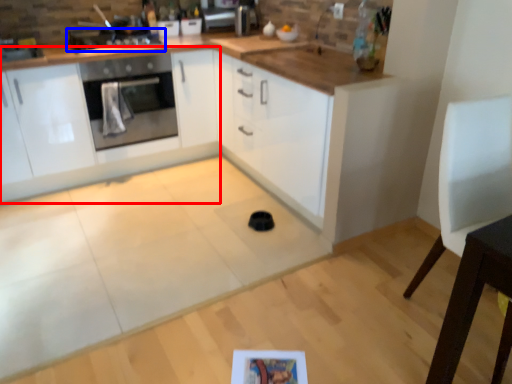
Question: Which point is further to the camera, cabinetry (highlighted by a red box) or kitchen appliance (highlighted by a blue box)?

Choices:
 (A) cabinetry
 (B) kitchen appliance

Answer: (B)